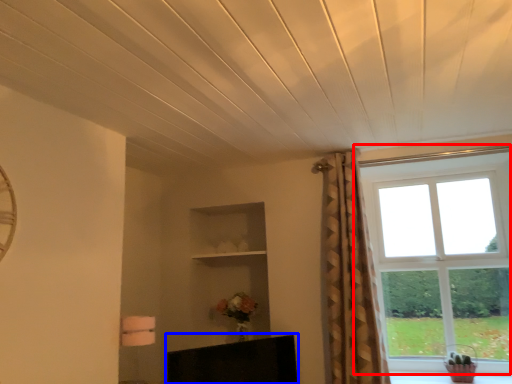
Question: Which object appears farthest to the camera in this image, window (highlighted by a red box) or furniture (highlighted by a blue box)?

Choices:
 (A) window
 (B) furniture

Answer: (A)